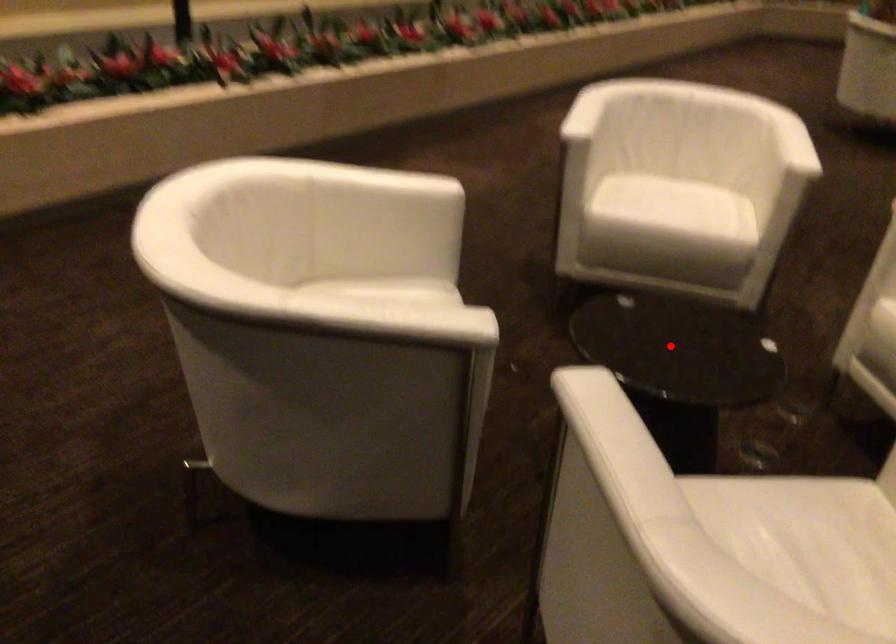
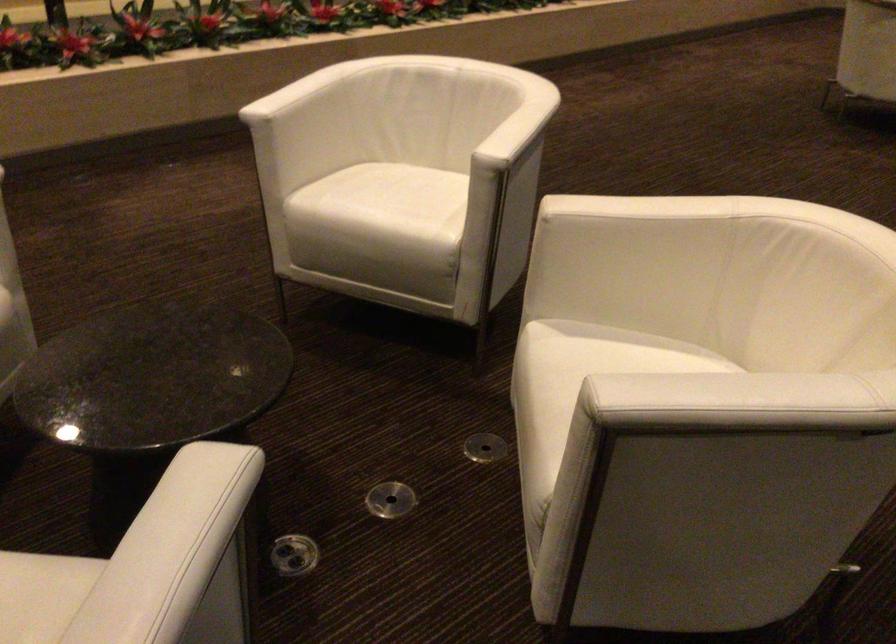
Question: I am providing you with two images of the same scene from different viewpoints. Given a red point in image1, look at the same physical point in image2. Is it:

Choices:
 (A) Closer to the viewpoint
 (B) Farther from the viewpoint

Answer: (A)